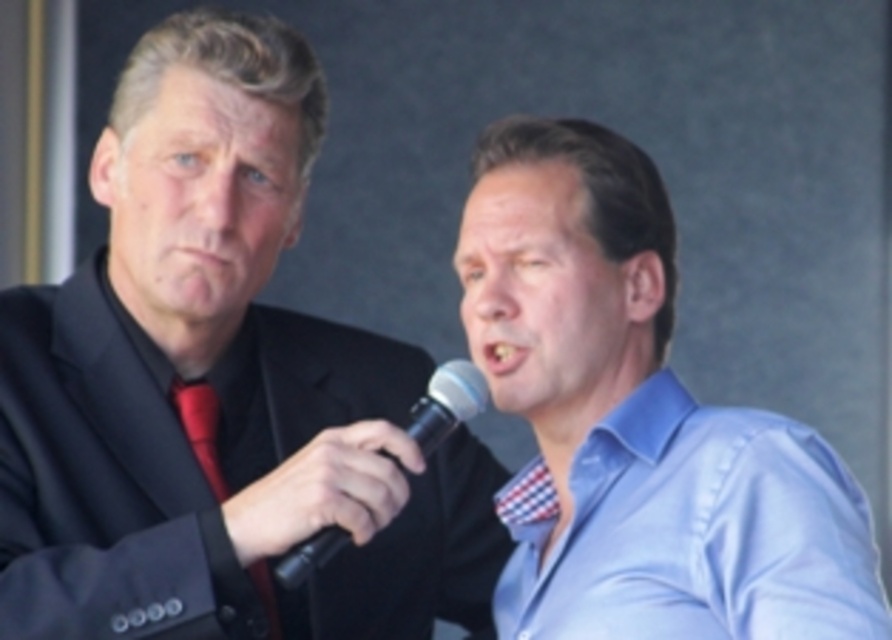
Question: Does blue satin shirt at center have a smaller size compared to light blue satin shirt at center?

Choices:
 (A) yes
 (B) no

Answer: (B)

Question: Is matte black suit at left closer to the viewer compared to blue satin shirt at center?

Choices:
 (A) yes
 (B) no

Answer: (B)

Question: Which is farther from the red satin tie at left?

Choices:
 (A) light blue satin shirt at center
 (B) blue satin shirt at center
 (C) black plastic microphone at center

Answer: (A)

Question: Among these points, which one is farthest from the camera?

Choices:
 (A) (774, 417)
 (B) (617, 182)

Answer: (B)

Question: Among these objects, which one is farthest from the camera?

Choices:
 (A) black plastic microphone at center
 (B) blue satin shirt at center

Answer: (A)

Question: Considering the relative positions of light blue satin shirt at center and red satin tie at left in the image provided, where is light blue satin shirt at center located with respect to red satin tie at left?

Choices:
 (A) below
 (B) above

Answer: (B)